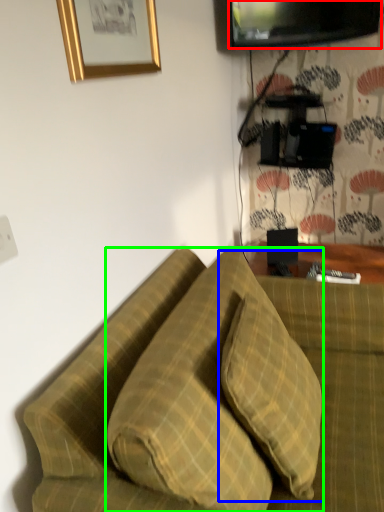
Question: Which object is positioned farthest from television (highlighted by a red box)? Select from pillow (highlighted by a blue box) and pillow (highlighted by a green box).

Choices:
 (A) pillow
 (B) pillow

Answer: (A)